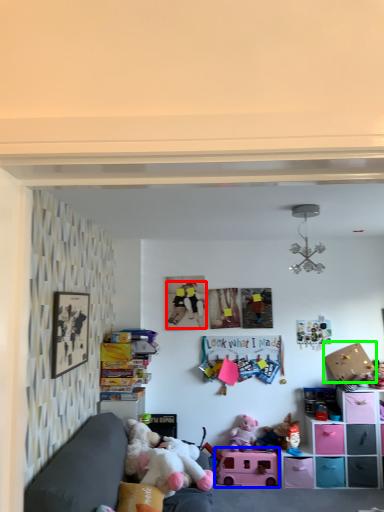
Question: Which object is positioned closest to person (highlighted by a red box)? Select from toy (highlighted by a blue box) and cardboard box (highlighted by a green box).

Choices:
 (A) toy
 (B) cardboard box

Answer: (A)